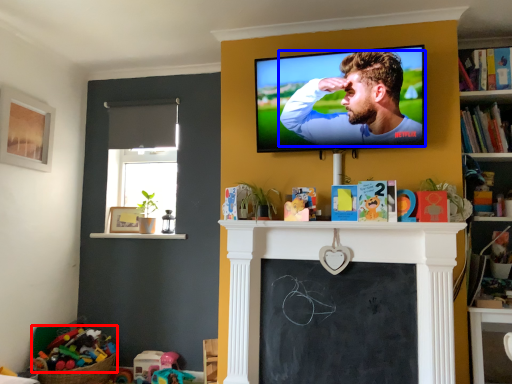
Question: Which object appears closest to the camera in this image, toy (highlighted by a red box) or man (highlighted by a blue box)?

Choices:
 (A) toy
 (B) man

Answer: (B)